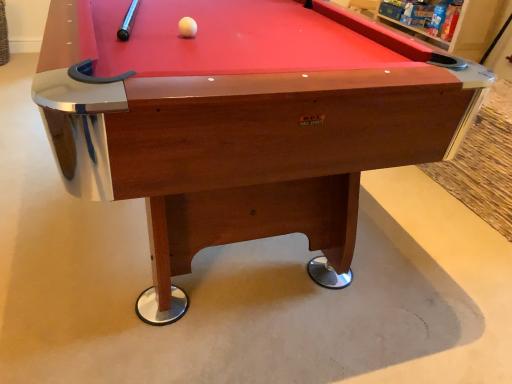
In order to click on white matte ball at center in this screenshot , I will do tap(187, 27).

What do you see at coordinates (187, 27) in the screenshot?
I see `white matte ball at center` at bounding box center [187, 27].

What is the approximate width of white matte ball at center?

white matte ball at center is 4.92 centimeters in width.

Locate an element on the screen. white matte ball at center is located at coordinates (187, 27).